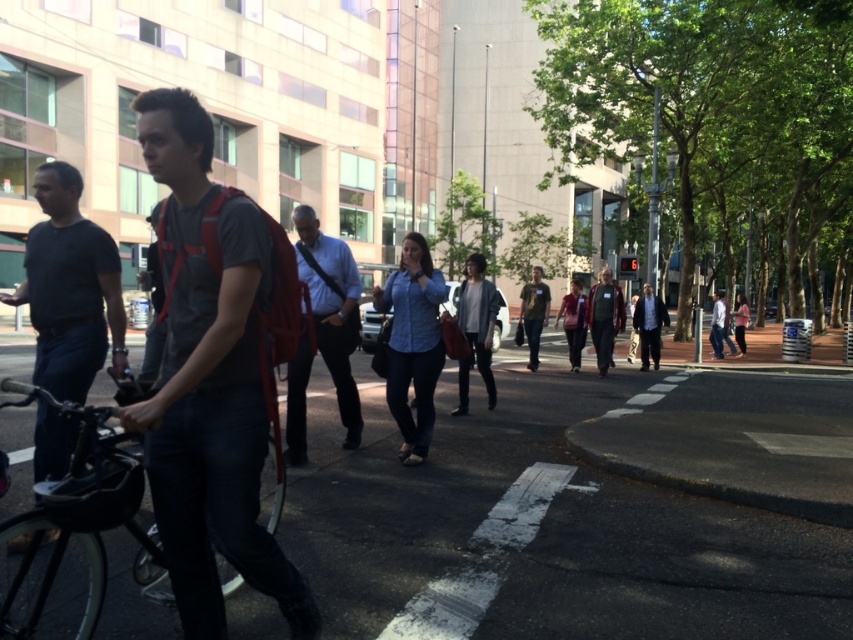
Question: Which of the following is the closest to the observer?

Choices:
 (A) light blue shirt at center
 (B) matte gray t-shirt at center
 (C) white shirt at center
 (D) dark gray fabric jacket at center

Answer: (B)

Question: Which object is farther from the camera taking this photo?

Choices:
 (A) denim shirt at center
 (B) matte pink jacket at center
 (C) matte gray t-shirt at center

Answer: (B)

Question: Which object appears farthest from the camera in this image?

Choices:
 (A) black matte bicycle at left
 (B) denim jacket at center
 (C) light blue shirt at center
 (D) dark gray fabric jacket at center

Answer: (D)

Question: Does black matte bicycle at left have a smaller size compared to matte pink jacket at center?

Choices:
 (A) yes
 (B) no

Answer: (A)

Question: From the image, what is the correct spatial relationship of dark gray shirt at left in relation to dark green fabric jacket at center?

Choices:
 (A) left
 (B) right

Answer: (A)

Question: Does light gray jacket at center appear on the right side of white shirt at center?

Choices:
 (A) yes
 (B) no

Answer: (B)